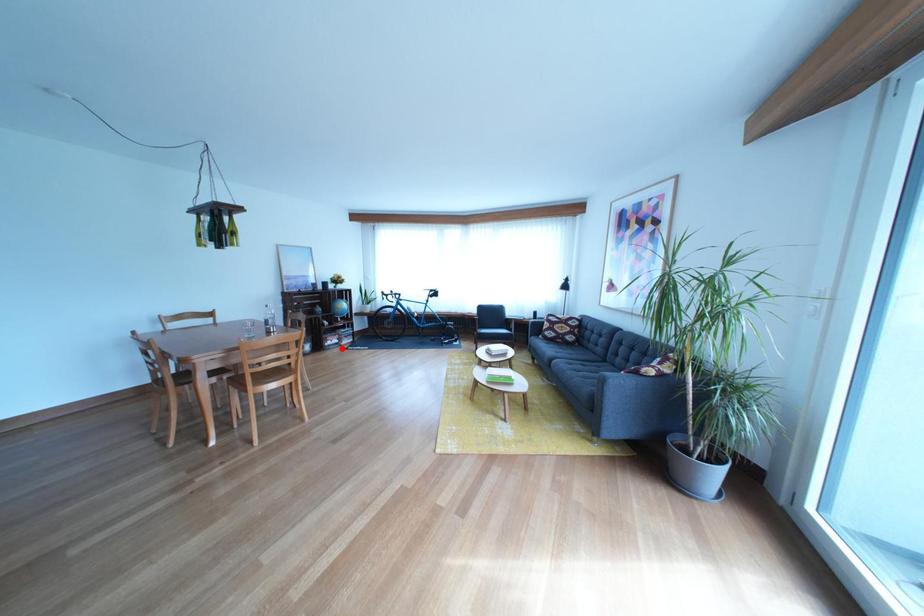
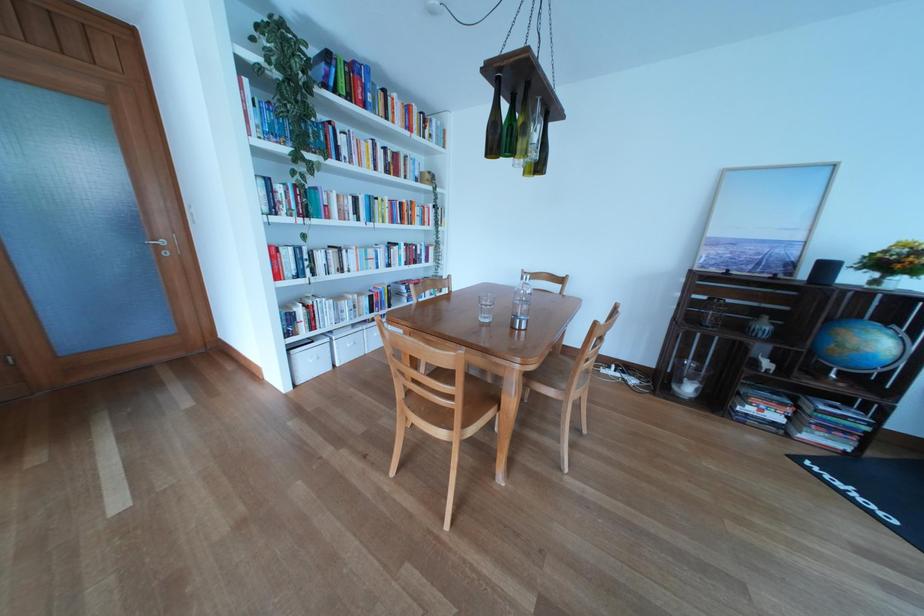
In the second image, find the point that corresponds to the highlighted location in the first image.

(762, 416)